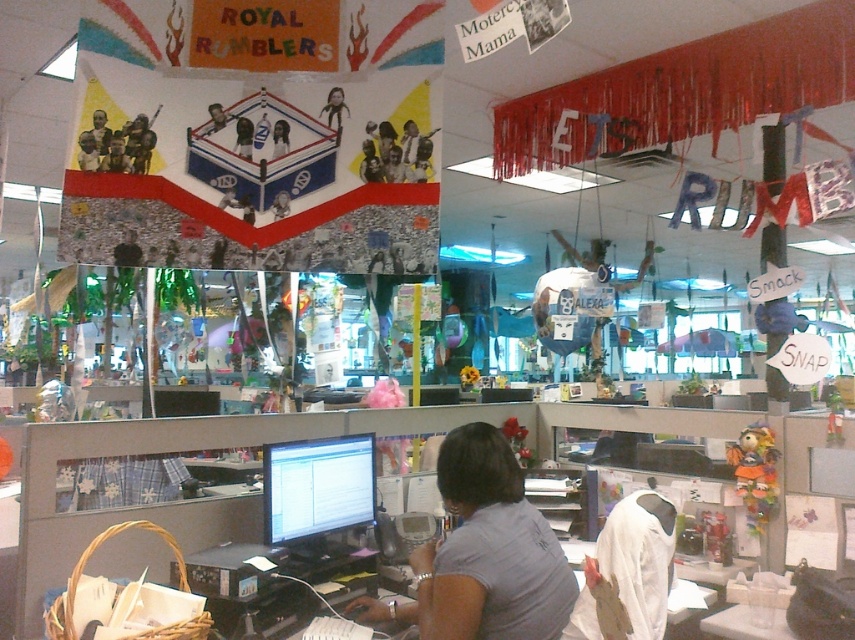
You are standing in the office and want to move from the point at coordinates (78, 156) to the point at coordinates (287, 125). Which direction should you move to reach your destination?

To move from point (78, 156) to point (287, 125), you should move backward since point (78, 156) is in front of point (287, 125).

You are sitting at the desk in the cubicle and need to reach the matte black monitor at center. Based on its position, can you estimate whether it is placed to your left or right side?

The matte black monitor at center is located at point coordinates which are in the center of the image, so from your seated position at the desk, it should be directly in front of you rather than to the left or right side.